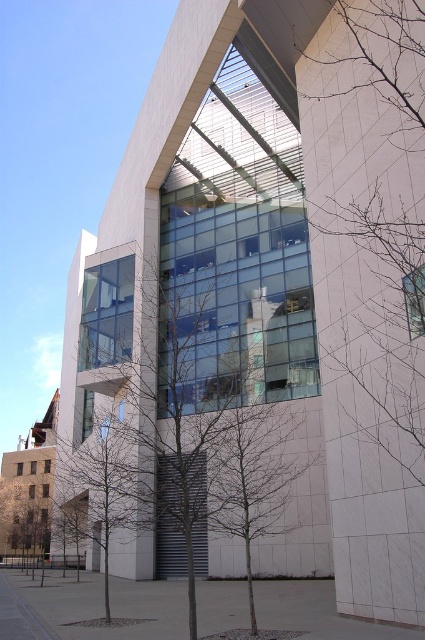
Who is taller, green leafless tree at center or bare branches at center?

Standing taller between the two is green leafless tree at center.

In the scene shown: Between green leafless tree at center and bare branches at center, which one appears on the right side from the viewer's perspective?

green leafless tree at center

Between point (260, 424) and point (119, 508), which one is positioned behind?

Point (260, 424)

Find the location of a particular element. green leafless tree at center is located at coordinates (178, 444).

Is bare branches at right taller than bare branches at center?

No.

Which of these two, bare branches at right or bare branches at center, stands shorter?

Standing shorter between the two is bare branches at right.

This screenshot has height=640, width=425. What do you see at coordinates (382, 317) in the screenshot? I see `bare branches at right` at bounding box center [382, 317].

I want to click on bare branches at right, so click(x=382, y=317).

Between green leafless tree at center and bare branches at right, which one appears on the left side from the viewer's perspective?

From the viewer's perspective, green leafless tree at center appears more on the left side.

Between green leafless tree at center and bare branches at right, which one has more height?

green leafless tree at center

Between point (125, 476) and point (405, 388), which one is positioned in front?

Point (405, 388) is more forward.

In order to click on green leafless tree at center in this screenshot , I will do `click(178, 444)`.